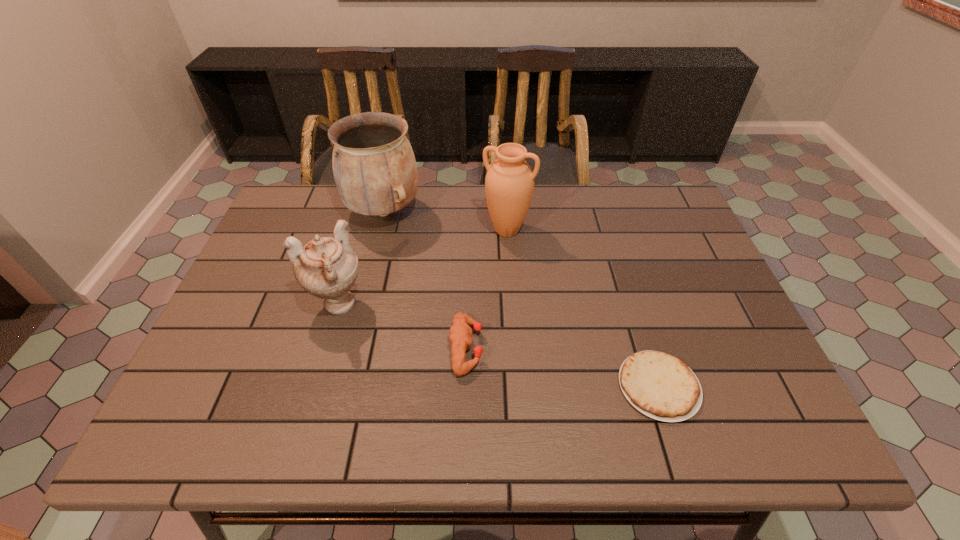
The width and height of the screenshot is (960, 540). I want to click on free space between the nearest urn and the third object from left to right, so click(x=402, y=326).

Where is `blank region between the puncher and the rightmost urn`? The height and width of the screenshot is (540, 960). blank region between the puncher and the rightmost urn is located at coordinates (487, 289).

This screenshot has height=540, width=960. In order to click on empty space between the fourth tallest object and the shortest object in this screenshot , I will do `click(563, 367)`.

This screenshot has width=960, height=540. I want to click on free space between the third tallest object and the third object from right to left, so click(x=402, y=326).

Locate an element on the screen. free spot between the rightmost urn and the third tallest object is located at coordinates (422, 268).

Identify which object is located as the fourth nearest to the second shortest object. Please provide its 2D coordinates. Your answer should be formatted as a tuple, i.e. [(x, y)], where the tuple contains the x and y coordinates of a point satisfying the conditions above.

[(374, 167)]

What are the coordinates of `the fourth closest object relative to the shortest object` in the screenshot? It's located at (374, 167).

Locate an element on the screen. The image size is (960, 540). the second closest urn relative to the rightmost object is located at coordinates (326, 267).

Find the location of a particular element. This screenshot has height=540, width=960. urn that is the third closest to the tortilla is located at coordinates (374, 167).

You are a GUI agent. You are given a task and a screenshot of the screen. Output one action in this format:
    pyautogui.click(x=<x>, y=<y>)
    Task: Click on the vacant area that satisfies the following two spatial constraints: 1. with the gloves of the third object from left to right facing forward; 2. on the back side of the tortilla
    The height and width of the screenshot is (540, 960).
    Given the screenshot: What is the action you would take?
    tap(466, 386)